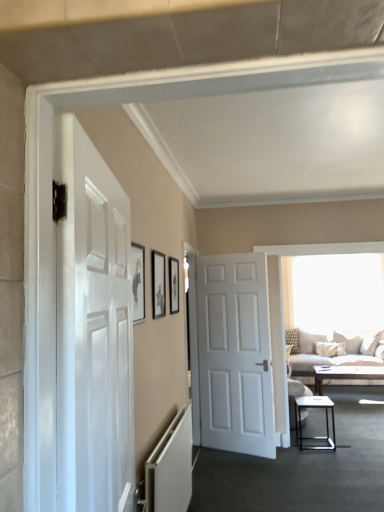
What do you see at coordinates (326, 421) in the screenshot? This screenshot has width=384, height=512. I see `black metal table at lower right` at bounding box center [326, 421].

The width and height of the screenshot is (384, 512). Describe the element at coordinates (337, 361) in the screenshot. I see `beige fabric couch at right` at that location.

Locate an element on the screen. This screenshot has height=512, width=384. transparent glass window at upper center is located at coordinates (335, 293).

What is the approximate width of matte black picture frame at upper center, which appears as the first picture frame when viewed from the left?

matte black picture frame at upper center, which appears as the first picture frame when viewed from the left, is 2.75 centimeters in width.

Where is `white matte radiator at lower left`? white matte radiator at lower left is located at coordinates click(171, 467).

Do you think transparent glass window at upper center is within matte black picture frame at center, which appears as the second picture frame when viewed from the right, or outside of it?

transparent glass window at upper center cannot be found inside matte black picture frame at center, which appears as the second picture frame when viewed from the right.

How different are the orientations of transparent glass window at upper center and matte black picture frame at center, the second picture frame in the front-to-back sequence, in degrees?

They differ by 90.5 degrees in their facing directions.

Is transparent glass window at upper center oriented away from matte black picture frame at center, the second picture frame in the front-to-back sequence?

No.

Does white matte door at center, which is the 2th door from left to right, turn towards white glossy door at left, the 2th door when ordered from right to left?

Yes, white matte door at center, which is the 2th door from left to right, is oriented towards white glossy door at left, the 2th door when ordered from right to left.

Which of these two, white matte door at center, positioned as the 1th door in right-to-left order, or white glossy door at left, the 2th door when ordered from right to left, is wider?

white matte door at center, positioned as the 1th door in right-to-left order, is wider.

From the image's perspective, is white matte door at center, which is the 2th door from left to right, over white glossy door at left, the 2th door when ordered from right to left?

No, from the image's perspective, white matte door at center, which is the 2th door from left to right, is not above white glossy door at left, the 2th door when ordered from right to left.

From a real-world perspective, is white matte door at center, positioned as the 1th door in right-to-left order, physically located above or below white glossy door at left, which ranks as the first door in front-to-back order?

white matte door at center, positioned as the 1th door in right-to-left order, is below white glossy door at left, which ranks as the first door in front-to-back order.

Is transparent glass window at upper center touching matte black picture frame at upper center, which appears as the first picture frame when viewed from the left?

transparent glass window at upper center and matte black picture frame at upper center, which appears as the first picture frame when viewed from the left, are not in contact.

Which object is further away from the camera, transparent glass window at upper center or matte black picture frame at upper center, positioned as the first picture frame in front-to-back order?

Positioned behind is transparent glass window at upper center.

From the image's perspective, between transparent glass window at upper center and matte black picture frame at upper center, which is the third picture frame from back to front, who is located below?

transparent glass window at upper center appears lower in the image.

Could you measure the distance between transparent glass window at upper center and matte black picture frame at upper center, which is the third picture frame from back to front?

A distance of 4.54 meters exists between transparent glass window at upper center and matte black picture frame at upper center, which is the third picture frame from back to front.

Considering the sizes of black metal table at lower right and white glossy door at left, placed as the second door when sorted from back to front, in the image, is black metal table at lower right wider or thinner than white glossy door at left, placed as the second door when sorted from back to front,?

Clearly, black metal table at lower right has more width compared to white glossy door at left, placed as the second door when sorted from back to front.

From a real-world perspective, is black metal table at lower right on top of white glossy door at left, placed as the second door when sorted from back to front?

No.

Considering their positions, is black metal table at lower right located in front of or behind white glossy door at left, the first door in the left-to-right sequence?

Visually, black metal table at lower right is located behind white glossy door at left, the first door in the left-to-right sequence.

Is black metal table at lower right further to the viewer compared to matte black picture frame at upper center, the third picture frame from the left?

Yes, black metal table at lower right is further from the viewer.

Considering the sizes of black metal table at lower right and matte black picture frame at upper center, the third picture frame in the front-to-back sequence, in the image, is black metal table at lower right taller or shorter than matte black picture frame at upper center, the third picture frame in the front-to-back sequence,?

black metal table at lower right is taller than matte black picture frame at upper center, the third picture frame in the front-to-back sequence.

Between black metal table at lower right and matte black picture frame at upper center, the third picture frame from the left, which one has smaller width?

Thinner between the two is matte black picture frame at upper center, the third picture frame from the left.

From a real-world perspective, which is physically below, black metal table at lower right or matte black picture frame at upper center, marked as the first picture frame in a right-to-left arrangement?

black metal table at lower right.

Does black metal table at lower right contain light brown wooden coffee table at center?

No, black metal table at lower right does not contain light brown wooden coffee table at center.

From the image's perspective, is black metal table at lower right above or below light brown wooden coffee table at center?

black metal table at lower right is situated higher than light brown wooden coffee table at center in the image.

Is black metal table at lower right at the right side of light brown wooden coffee table at center?

No, black metal table at lower right is not to the right of light brown wooden coffee table at center.

From a real-world perspective, who is located lower, black metal table at lower right or light brown wooden coffee table at center?

light brown wooden coffee table at center.

Based on their positions, is white matte door at center, the second door when ordered from front to back, located to the left or right of matte black picture frame at center, which is the 2th picture frame in back-to-front order?

Based on their positions, white matte door at center, the second door when ordered from front to back, is located to the right of matte black picture frame at center, which is the 2th picture frame in back-to-front order.

From the image's perspective, is white matte door at center, the second door when ordered from front to back, located beneath matte black picture frame at center, the second picture frame positioned from the left?

Indeed, from the image's perspective, white matte door at center, the second door when ordered from front to back, is shown beneath matte black picture frame at center, the second picture frame positioned from the left.

In terms of width, does white matte door at center, placed as the 1th door when sorted from back to front, look wider or thinner when compared to matte black picture frame at center, which appears as the second picture frame when viewed from the right?

Result: Considering their sizes, white matte door at center, placed as the 1th door when sorted from back to front, looks broader than matte black picture frame at center, which appears as the second picture frame when viewed from the right.

Find the location of a particular element. door located behind the matte black picture frame at center, the second picture frame in the front-to-back sequence is located at coordinates (232, 354).

From a real-world perspective, which picture frame is the 1st one above the transparent glass window at upper center? Please provide its 2D coordinates.

[(158, 284)]

Locate an element on the screen. This screenshot has height=512, width=384. door on the left of white matte door at center, placed as the 1th door when sorted from back to front is located at coordinates (93, 330).

From the image, which object appears to be farther from black metal table at lower right, transparent glass window at upper center or white matte door at center, positioned as the 1th door in right-to-left order?

Based on the image, transparent glass window at upper center appears to be further to black metal table at lower right.

When comparing their distances from matte black picture frame at upper center, which is the third picture frame from back to front, does white matte radiator at lower left or matte black picture frame at upper center, the third picture frame from the left, seem further?

white matte radiator at lower left is further to matte black picture frame at upper center, which is the third picture frame from back to front.

Which object lies nearer to the anchor point matte black picture frame at upper center, marked as the first picture frame in a right-to-left arrangement, light brown wooden coffee table at center or white glossy door at left, the 2th door when ordered from right to left?

Among the two, white glossy door at left, the 2th door when ordered from right to left, is located nearer to matte black picture frame at upper center, marked as the first picture frame in a right-to-left arrangement.

From the picture: Looking at the image, which one is located further to matte black picture frame at upper center, the third picture frame from the left, matte black picture frame at center, the second picture frame in the front-to-back sequence, or matte black picture frame at upper center, positioned as the first picture frame in front-to-back order?

Among the two, matte black picture frame at upper center, positioned as the first picture frame in front-to-back order, is located further to matte black picture frame at upper center, the third picture frame from the left.

Considering their positions, is light brown wooden coffee table at center positioned closer to beige fabric couch at right than white glossy door at left, placed as the second door when sorted from back to front?

The object closer to beige fabric couch at right is light brown wooden coffee table at center.

Considering their positions, is white matte door at center, positioned as the 1th door in right-to-left order, positioned further to matte black picture frame at center, the second picture frame positioned from the left, than white matte radiator at lower left?

white matte door at center, positioned as the 1th door in right-to-left order.

When comparing their distances from beige fabric couch at right, does white matte door at center, placed as the 1th door when sorted from back to front, or matte black picture frame at upper center, the third picture frame in the front-to-back sequence, seem closer?

Based on the image, white matte door at center, placed as the 1th door when sorted from back to front, appears to be nearer to beige fabric couch at right.

Estimate the real-world distances between objects in this image. Which object is further from matte black picture frame at center, the second picture frame in the front-to-back sequence, white matte door at center, positioned as the 1th door in right-to-left order, or beige fabric couch at right?

beige fabric couch at right is positioned further to the anchor matte black picture frame at center, the second picture frame in the front-to-back sequence.

The image size is (384, 512). What are the coordinates of `table between white matte door at center, positioned as the 1th door in right-to-left order, and light brown wooden coffee table at center, along the z-axis` in the screenshot? It's located at (326, 421).

Where is `coffee table positioned between matte black picture frame at upper center, marked as the first picture frame in a right-to-left arrangement, and transparent glass window at upper center from near to far`? coffee table positioned between matte black picture frame at upper center, marked as the first picture frame in a right-to-left arrangement, and transparent glass window at upper center from near to far is located at coordinates (345, 374).

The image size is (384, 512). Identify the location of studio couch located between black metal table at lower right and light brown wooden coffee table at center in the depth direction. (337, 361).

You are a GUI agent. You are given a task and a screenshot of the screen. Output one action in this format:
    pyautogui.click(x=<x>, y=<y>)
    Task: Click on the radiator between white glossy door at left, placed as the second door when sorted from back to front, and matte black picture frame at upper center, marked as the first picture frame in a right-to-left arrangement, from front to back
    
    Given the screenshot: What is the action you would take?
    pyautogui.click(x=171, y=467)